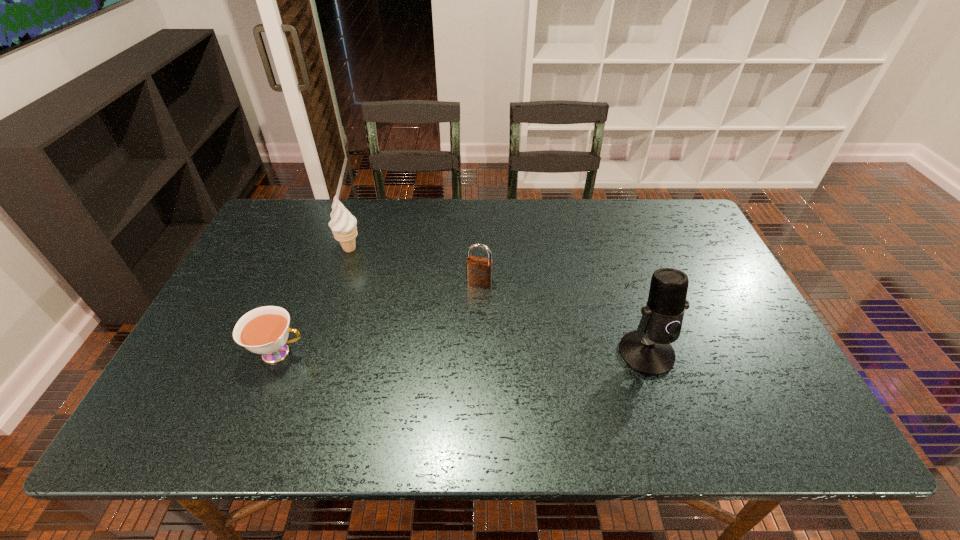
In the image, there is a desktop. What are the coordinates of `vacant space at the far edge` in the screenshot? It's located at (372, 244).

In the image, there is a desktop. Where is `vacant space at the right edge`? The height and width of the screenshot is (540, 960). vacant space at the right edge is located at coordinates (707, 246).

Identify the location of vacant region at the near left corner of the desktop. (193, 369).

In order to click on free space at the far right corner in this screenshot , I will do `click(653, 223)`.

Identify the location of free space between the icecream and the shortest object. (314, 301).

This screenshot has height=540, width=960. Identify the location of blank region between the teacup and the third object from left to right. (379, 318).

Locate an element on the screen. This screenshot has width=960, height=540. free space between the tallest object and the third tallest object is located at coordinates (563, 318).

Locate an element on the screen. free space between the icecream and the second object from right to left is located at coordinates (415, 265).

Find the location of a particular element. free space between the third tallest object and the farthest object is located at coordinates (415, 265).

Locate an element on the screen. The image size is (960, 540). vacant space that is in between the microphone and the padlock is located at coordinates (563, 318).